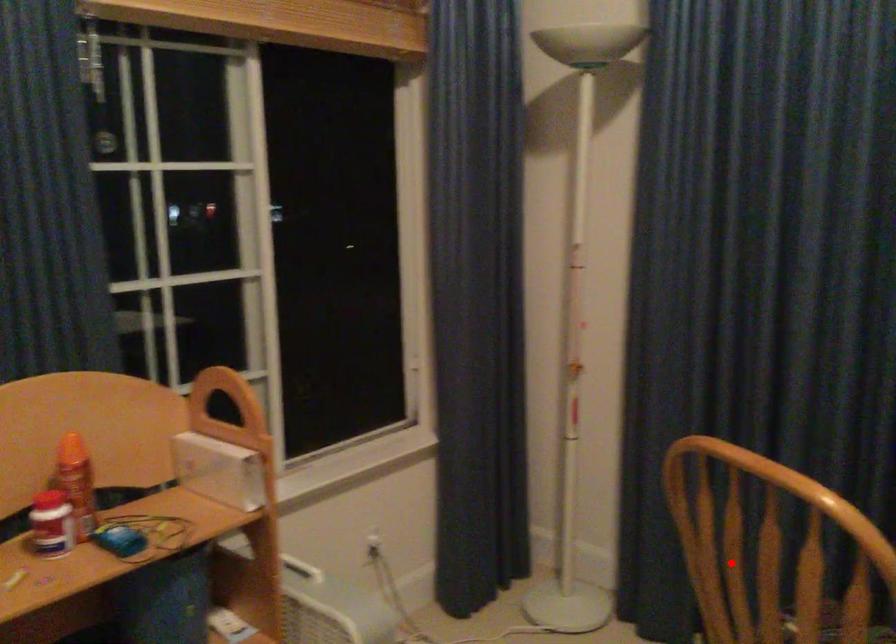
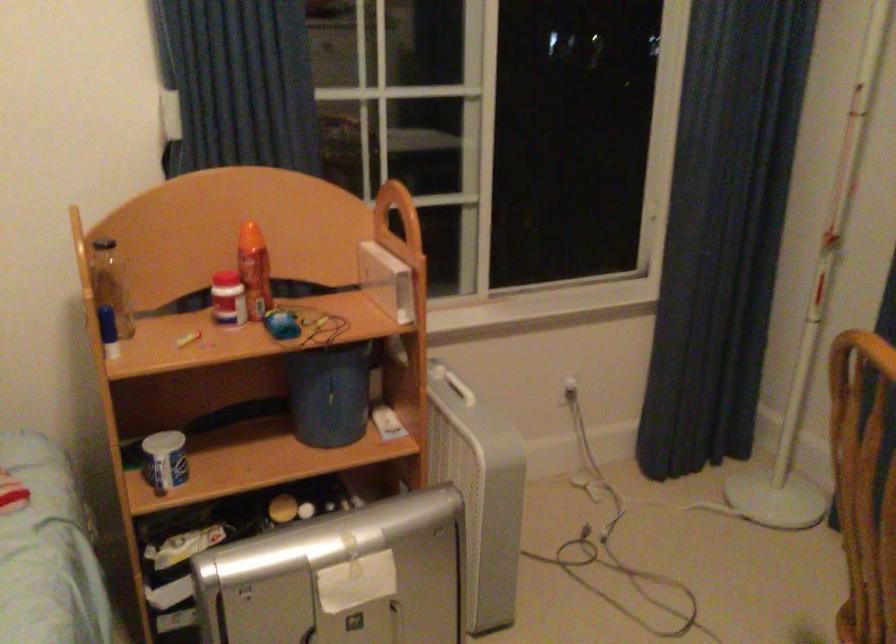
Question: I am providing you with two images of the same scene from different viewpoints. Given a red point in image1, look at the same physical point in image2. Is it:

Choices:
 (A) Closer to the viewpoint
 (B) Farther from the viewpoint

Answer: (A)